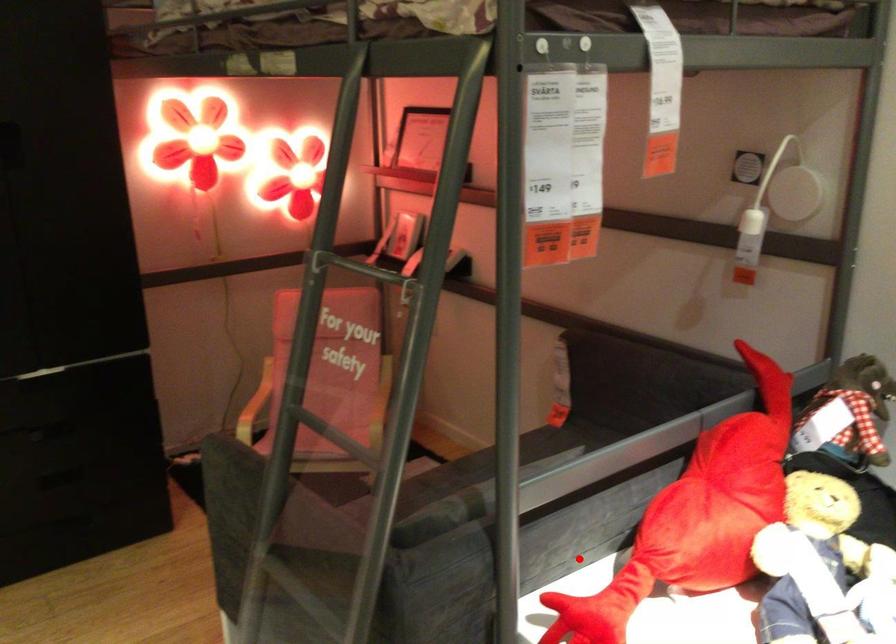
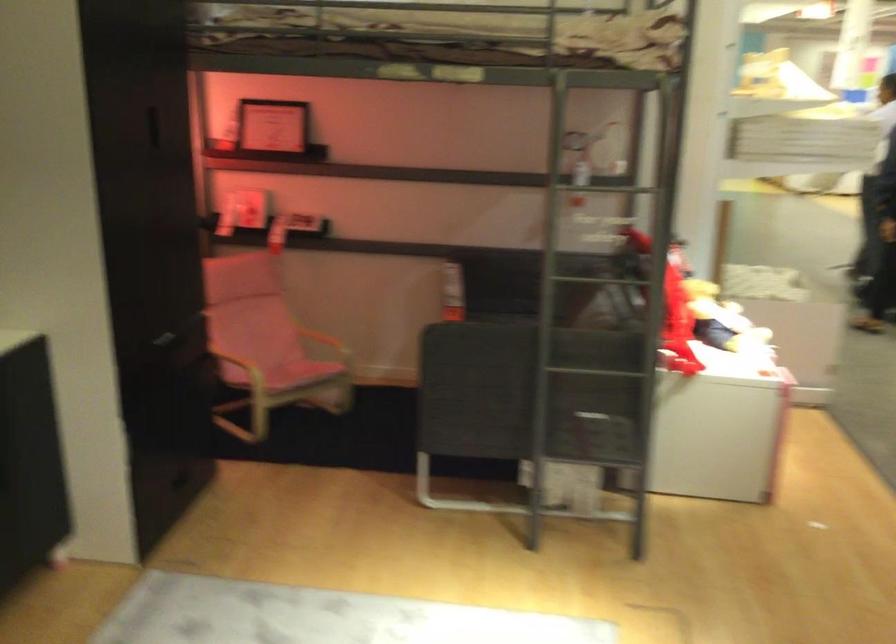
Question: I am providing you with two images of the same scene from different viewpoints. A red point is shown in image1. For the corresponding object point in image2, is it positioned nearer or farther from the camera?

Choices:
 (A) Nearer
 (B) Farther

Answer: (B)